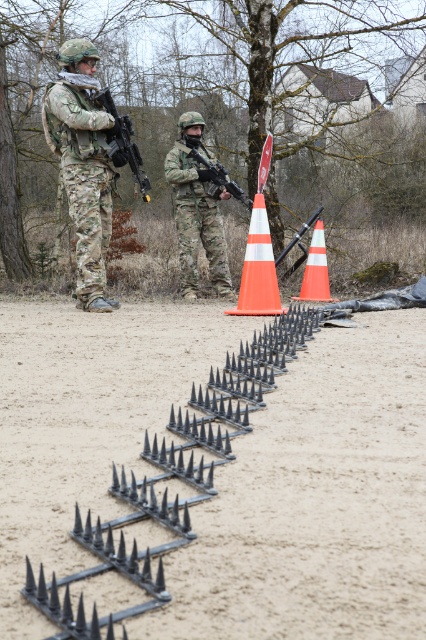
You are a photographer positioned at the back of the scene. You want to take a photo that includes both the camouflage fabric uniform at left and the matte black rifle at center. Which object should you adjust your focus on first to ensure both are in frame?

The camouflage fabric uniform at left is closer to the viewer than the matte black rifle at center, so you should focus on the camouflage fabric uniform at left first to ensure both are in frame.

You are a military trainee who needs to carry both the black metal spikes at center and the matte black rifle at upper left. Which item should you pick up first if you want to carry the heavier object first?

The matte black rifle at upper left is larger than the black metal spikes at center, so it is likely heavier. You should pick up the matte black rifle at upper left first.

You are a drone operator controlling a drone that is 0.5 meters in height. You need to fly the drone to the point at coordinates point (x=183, y=236). The camera you are using has a height of 12 meters. Can your drone reach the point without crashing into the camera?

The point (x=183, y=236) and the camera are 11.68 meters apart. Since the camera is at 12 meters height and the drone is only 0.5 meters tall, there is enough vertical clearance for the drone to safely reach the point without crashing into the camera.